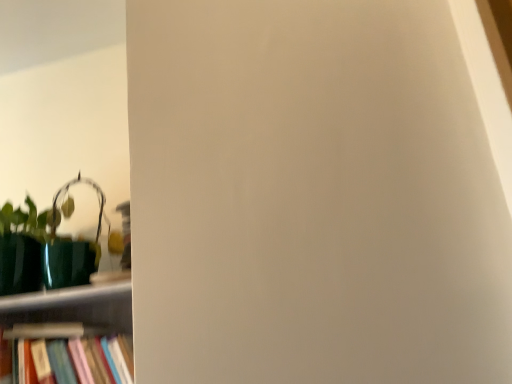
The width and height of the screenshot is (512, 384). Find the location of `hardcover books at lower left`. hardcover books at lower left is located at coordinates (71, 358).

This screenshot has height=384, width=512. What do you see at coordinates (71, 358) in the screenshot?
I see `hardcover books at lower left` at bounding box center [71, 358].

Image resolution: width=512 pixels, height=384 pixels. Identify the location of hardcover books at lower left. (71, 358).